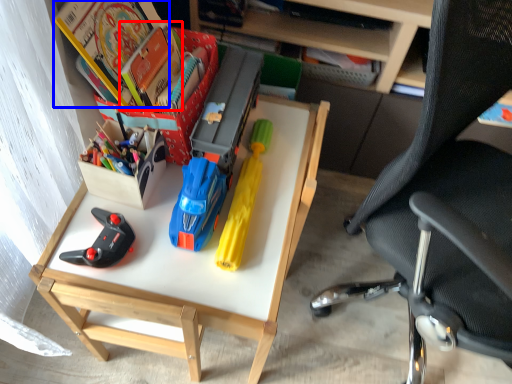
Question: Among these objects, which one is farthest to the camera, book (highlighted by a red box) or book (highlighted by a blue box)?

Choices:
 (A) book
 (B) book

Answer: (A)